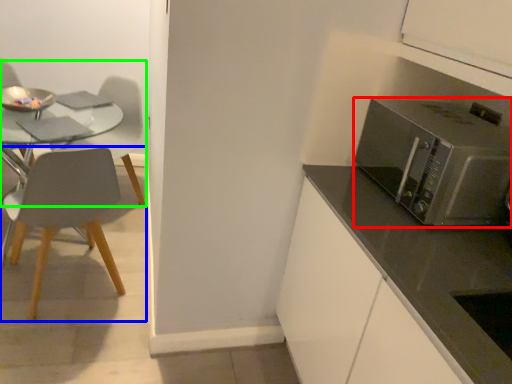
Question: Which object is positioned farthest from microwave oven (highlighted by a red box)? Select from chair (highlighted by a blue box) and chair (highlighted by a green box).

Choices:
 (A) chair
 (B) chair

Answer: (B)